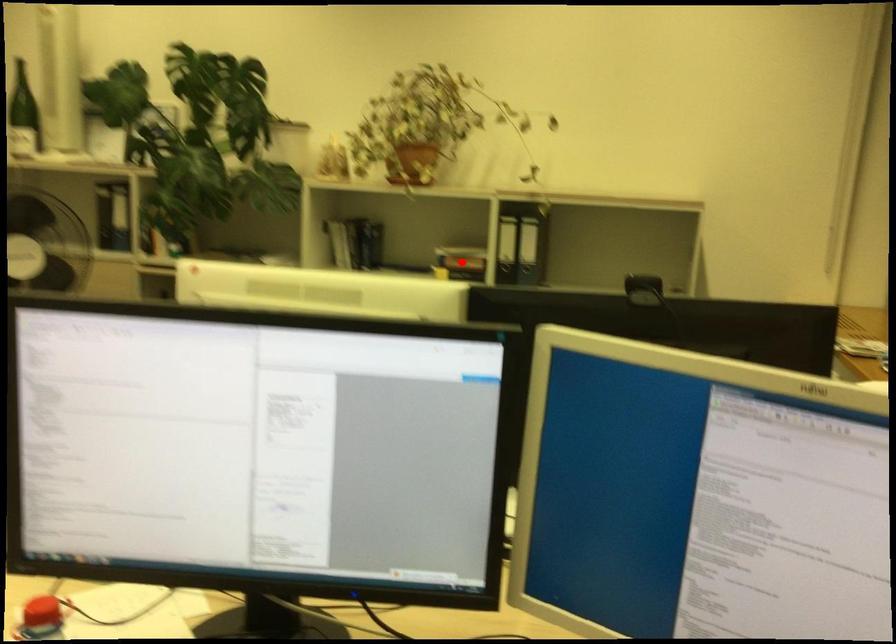
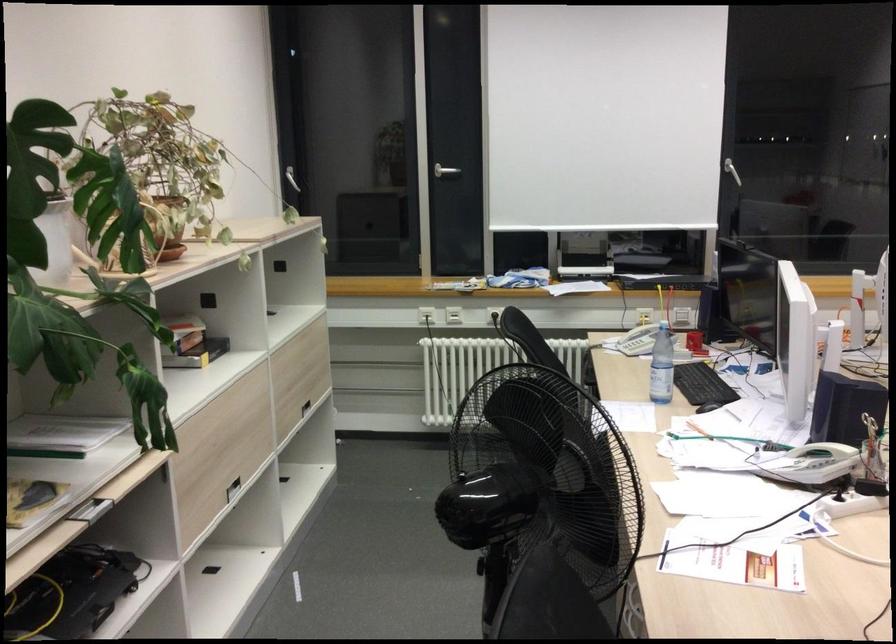
Where in the second image is the point corresponding to the highlighted location from the first image?

(192, 343)